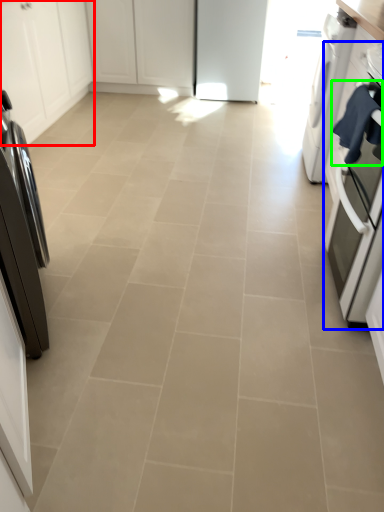
Question: Based on their relative distances, which object is farther from cabinetry (highlighted by a red box)? Choose from kitchen appliance (highlighted by a blue box) and laundry (highlighted by a green box).

Choices:
 (A) kitchen appliance
 (B) laundry

Answer: (B)